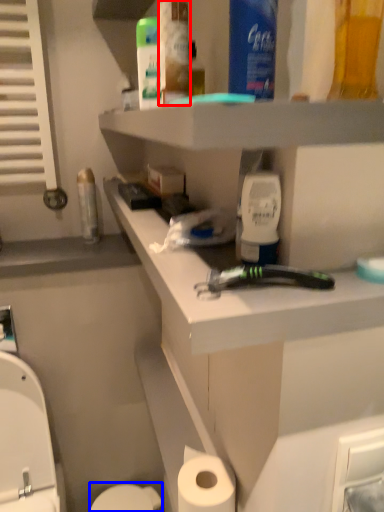
Question: Which object is closer to the camera taking this photo, mouthwash (highlighted by a red box) or toilet bowl (highlighted by a blue box)?

Choices:
 (A) mouthwash
 (B) toilet bowl

Answer: (A)